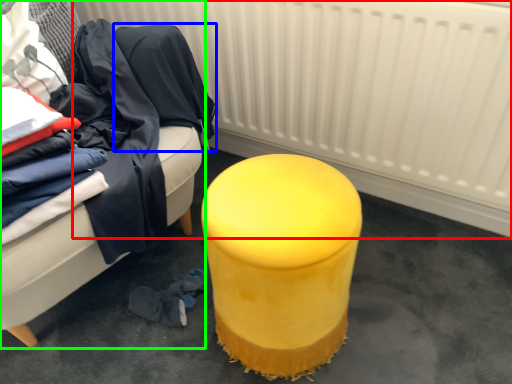
Question: Which object is the farthest from radiator (highlighted by a red box)? Choose among these: clothing (highlighted by a blue box) or furniture (highlighted by a green box).

Choices:
 (A) clothing
 (B) furniture

Answer: (B)